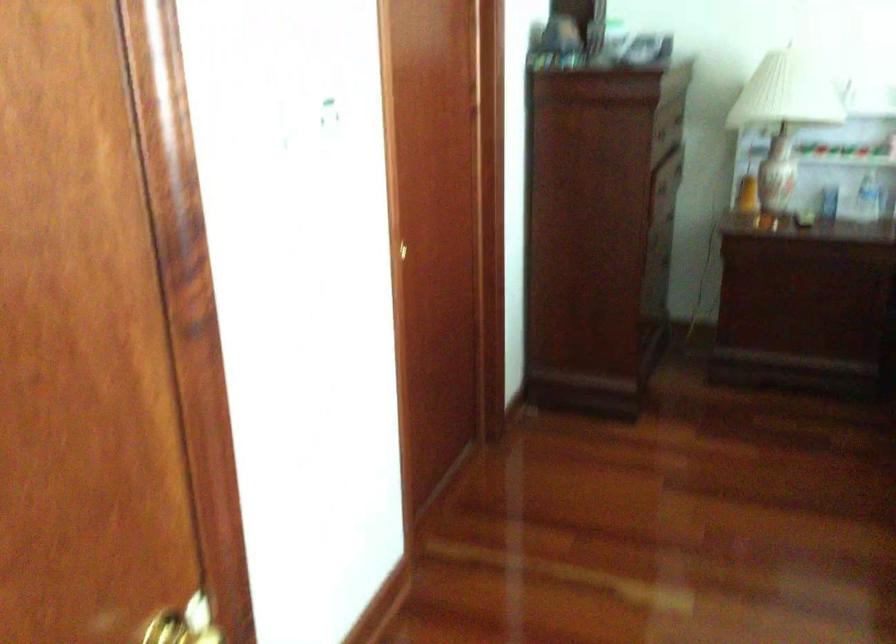
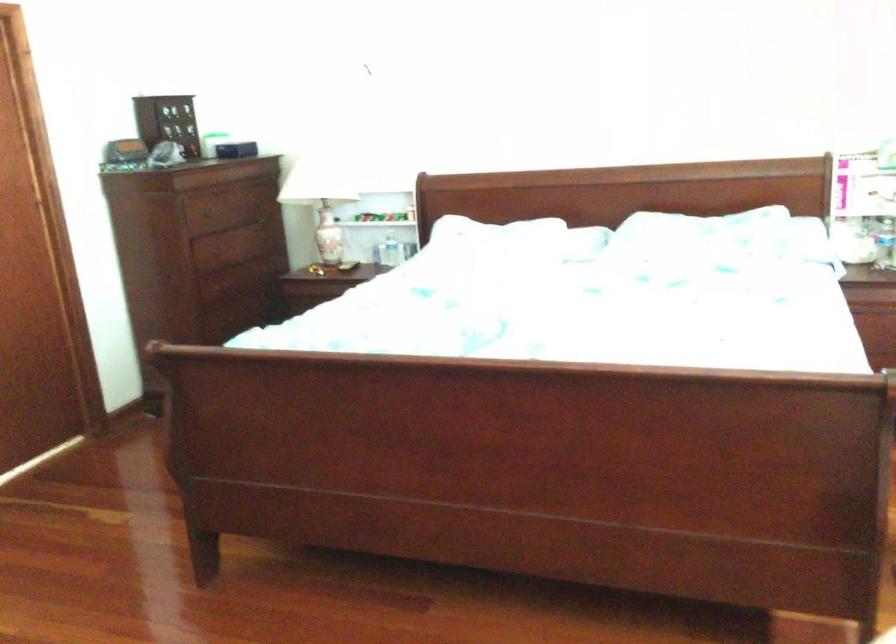
In the second image, find the point that corresponds to point (823, 190) in the first image.

(390, 251)